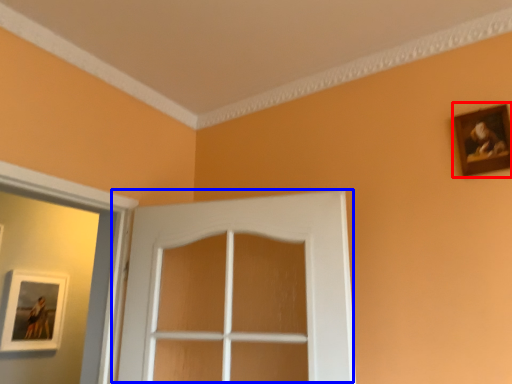
Question: Which object appears closest to the camera in this image, picture frame (highlighted by a red box) or door (highlighted by a blue box)?

Choices:
 (A) picture frame
 (B) door

Answer: (B)